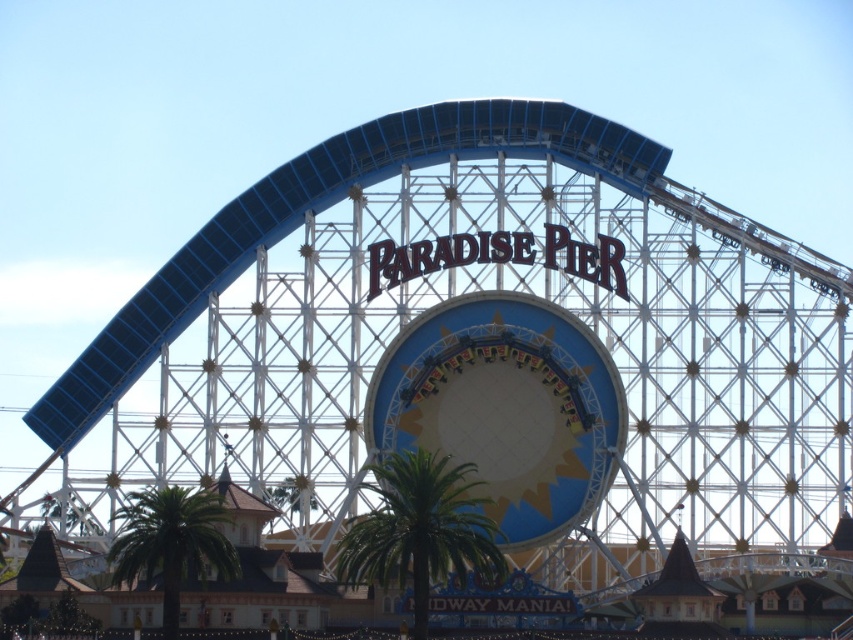
You are standing at the entrance of Paradise Pier amusement park and want to locate the main roller coaster. According to the map, there is a point marked at coordinates point [505,406]. What does this point indicate?

The point [505,406] indicates the location of the matte blue and white amusement ride at center, which is the main roller coaster.

You are a visitor at Paradise Pier and want to take a photo of the roller coaster with the palm trees in the background. Which palm tree, the green leafy palm tree at center or the green leafy palm tree at lower left, is closer to the camera?

The green leafy palm tree at lower left is closer to the camera because the green leafy palm tree at center is positioned over it, indicating it is behind.

You are a visitor at Paradise Pier and want to take a photo of the green leafy palm tree at lower left without the matte blue and white amusement ride at center blocking the view. Is this possible?

The matte blue and white amusement ride at center is much taller than the green leafy palm tree at lower left, so it will block the view of the palm tree. You cannot take a photo of the green leafy palm tree at lower left without the ride blocking the view.